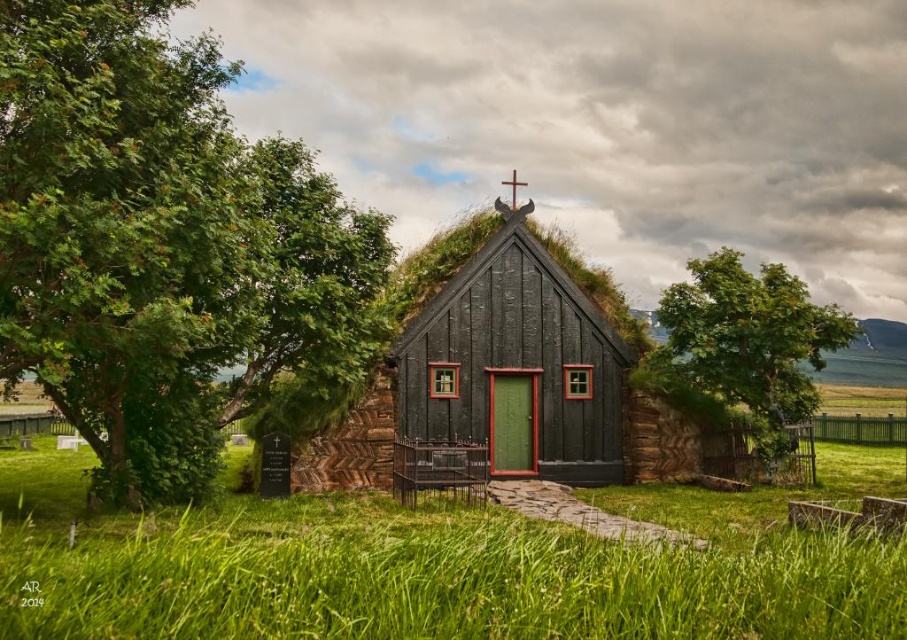
Is matte black wooden cottage at center taller than green leafy tree at right?

Yes, matte black wooden cottage at center is taller than green leafy tree at right.

Does matte black wooden cottage at center have a smaller size compared to green leafy tree at right?

Actually, matte black wooden cottage at center might be larger than green leafy tree at right.

Locate an element on the screen. The width and height of the screenshot is (907, 640). matte black wooden cottage at center is located at coordinates (504, 372).

Who is taller, green grass at center or matte black wooden cottage at center?

matte black wooden cottage at center is taller.

Consider the image. Does green grass at center appear on the left side of matte black wooden cottage at center?

Correct, you'll find green grass at center to the left of matte black wooden cottage at center.

At what (x,y) coordinates should I click in order to perform the action: click on green grass at center. Please return your answer as a coordinate pair (x, y). The width and height of the screenshot is (907, 640). Looking at the image, I should click on (413, 573).

What do you see at coordinates (413, 573) in the screenshot? I see `green grass at center` at bounding box center [413, 573].

This screenshot has width=907, height=640. In order to click on green grass at center in this screenshot , I will do `click(413, 573)`.

Where is `green grass at center`? green grass at center is located at coordinates (413, 573).